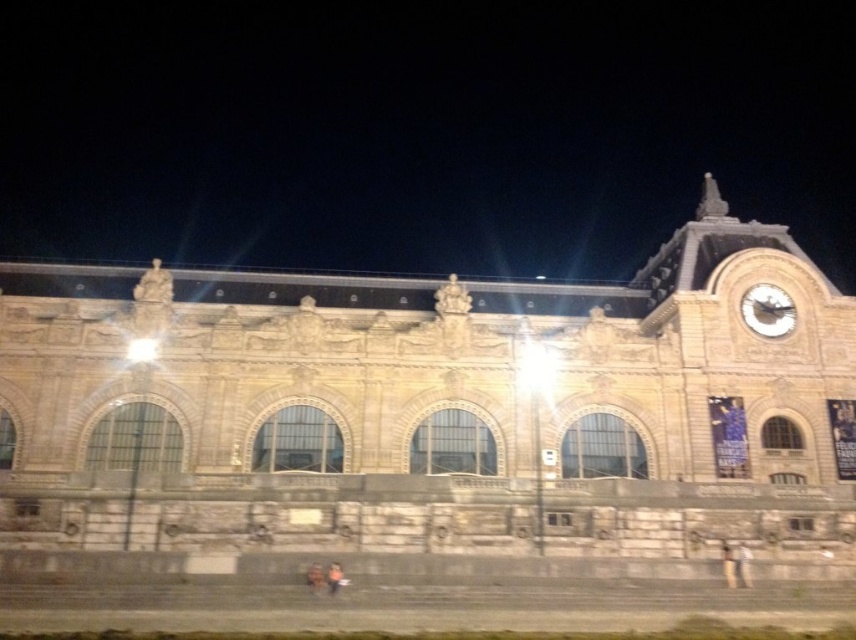
Question: Which point is closer to the camera taking this photo?

Choices:
 (A) (311, 588)
 (B) (336, 566)
 (C) (116, 116)

Answer: (A)

Question: Among these objects, which one is farthest from the camera?

Choices:
 (A) orange fabric bag at lower center
 (B) metallic clock face at upper right
 (C) stone clock tower at center

Answer: (C)

Question: Can you confirm if dark brown leather jacket at lower center is smaller than orange fabric bag at lower center?

Choices:
 (A) no
 (B) yes

Answer: (A)

Question: Does stone clock tower at center appear over dark brown leather jacket at lower center?

Choices:
 (A) yes
 (B) no

Answer: (A)

Question: Which object appears farthest from the camera in this image?

Choices:
 (A) metallic clock face at upper right
 (B) orange fabric bag at lower center
 (C) stone clock tower at center

Answer: (C)

Question: Is stone clock tower at center in front of metallic clock face at upper right?

Choices:
 (A) no
 (B) yes

Answer: (A)